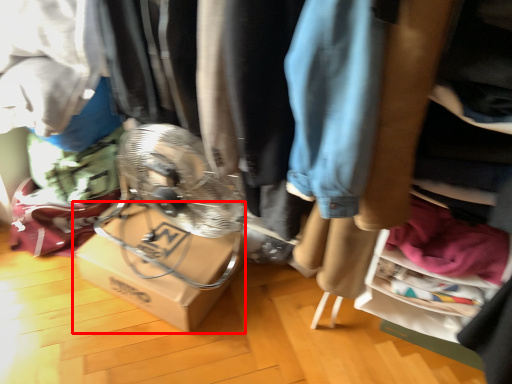
Question: From the image, what is the correct spatial relationship of cardboard box (annotated by the red box) in relation to clothing?

Choices:
 (A) right
 (B) left

Answer: (B)